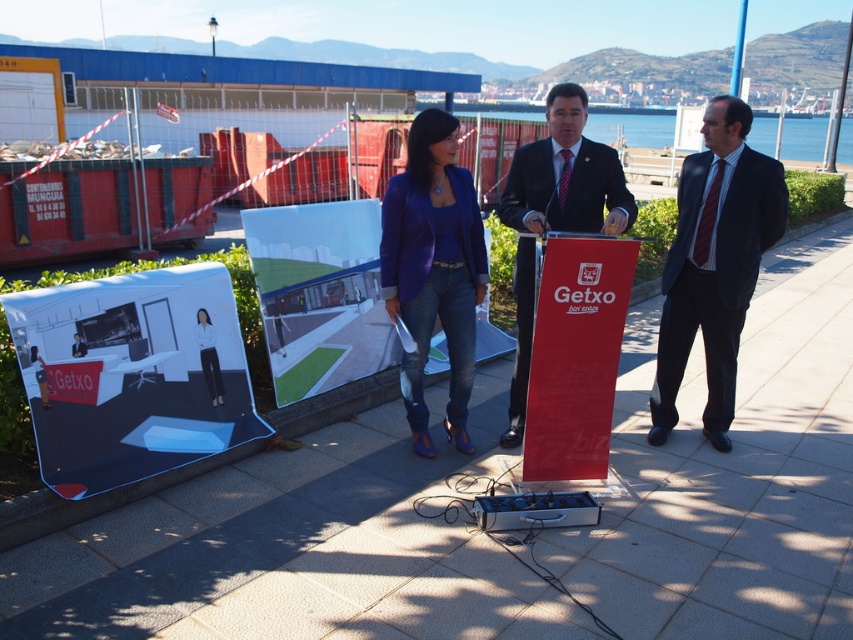
Which is more to the right, matte concrete pavement at center or matte purple blazer at center?

Positioned to the right is matte concrete pavement at center.

Which is behind, point (741, 570) or point (473, 346)?

The point (473, 346) is behind.

Who is more distant from viewer, (x=112, y=570) or (x=422, y=365)?

Positioned behind is point (x=422, y=365).

The image size is (853, 640). What are the coordinates of `matte concrete pavement at center` in the screenshot? It's located at (292, 550).

Is matte purple blazer at center to the left of matte black suit at center from the viewer's perspective?

Indeed, matte purple blazer at center is positioned on the left side of matte black suit at center.

Identify the location of matte purple blazer at center. (433, 269).

You are a GUI agent. You are given a task and a screenshot of the screen. Output one action in this format:
    pyautogui.click(x=<x>, y=<y>)
    Task: Click on the matte purple blazer at center
    
    Given the screenshot: What is the action you would take?
    pyautogui.click(x=433, y=269)

This screenshot has height=640, width=853. In order to click on matte purple blazer at center in this screenshot , I will do `click(433, 269)`.

Is point (724, 403) positioned behind point (567, 120)?

Yes, it is behind point (567, 120).

Between point (750, 168) and point (508, 444), which one is positioned in front?

Point (750, 168) is in front.

Who is more forward, (691, 186) or (556, 186)?

Point (556, 186) is in front.

The height and width of the screenshot is (640, 853). Find the location of `dark blue suit at center`. dark blue suit at center is located at coordinates (714, 262).